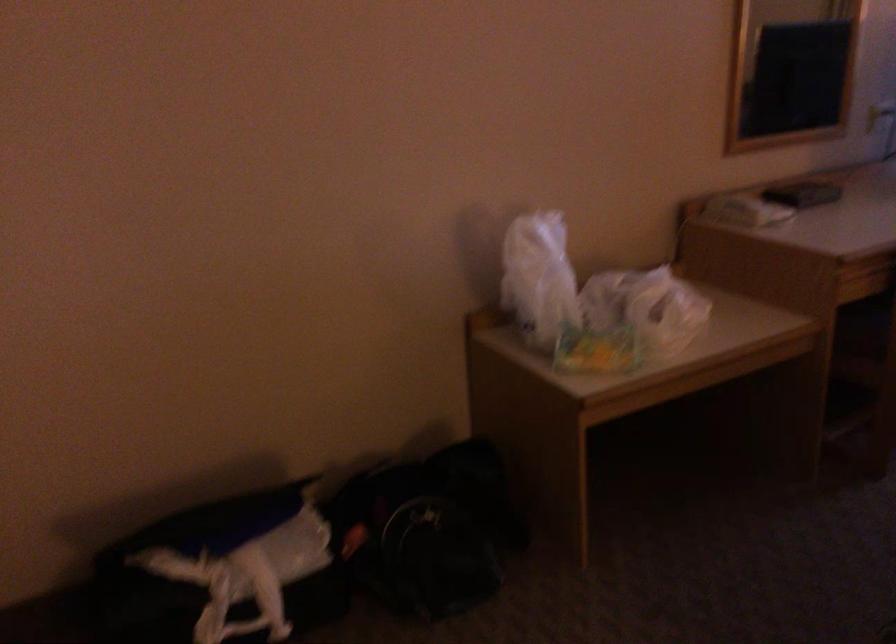
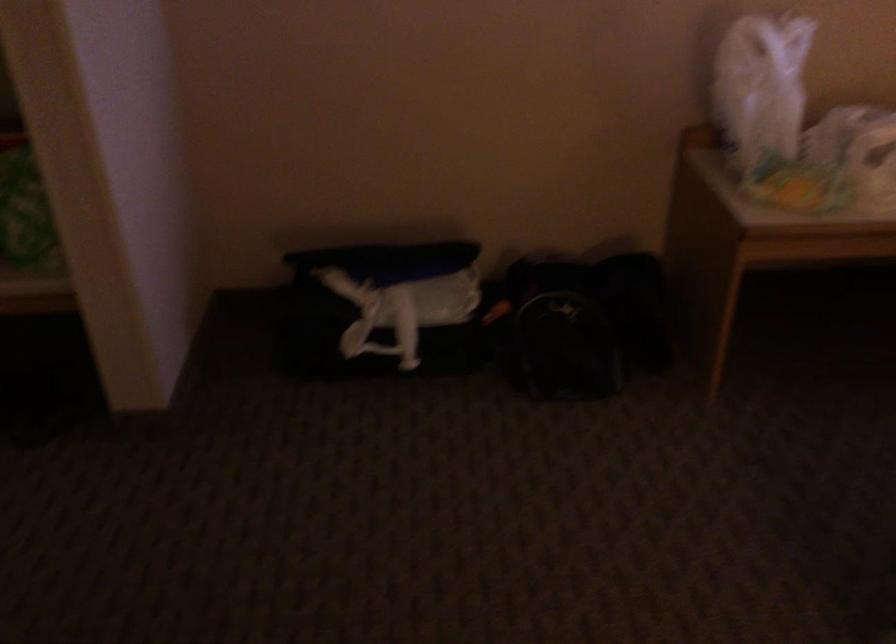
Question: In a continuous first-person perspective shot, in which direction is the camera moving?

Choices:
 (A) Left
 (B) Right
 (C) Forward
 (D) Backward

Answer: (B)